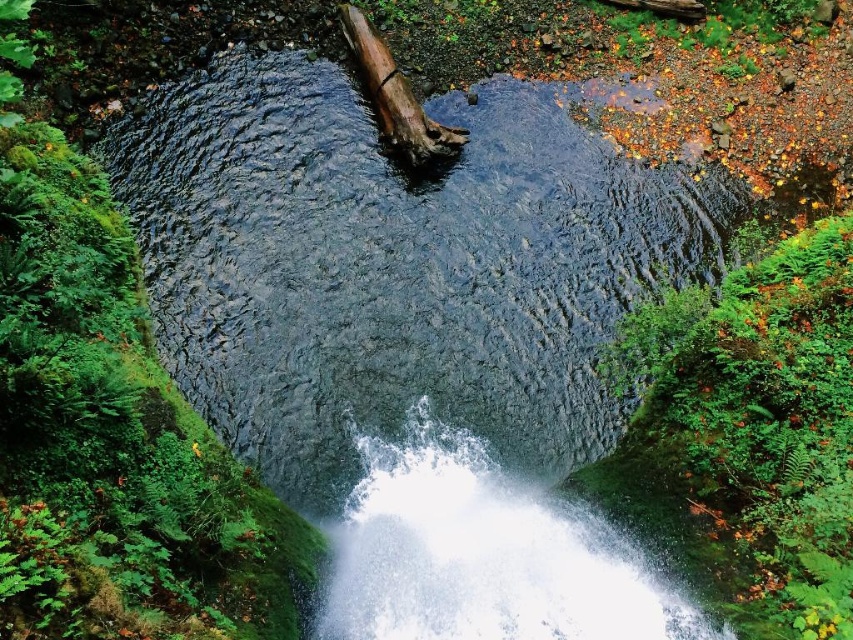
You are standing at the edge of the pool and want to cross to the other side. There is a white frothy water at center and a brown rough log at center. Which object should you step on to avoid getting wet?

The brown rough log at center is behind the white frothy water at center, so stepping on the brown rough log at center would keep you dry.

You are standing at the edge of the pool and want to avoid the white frothy water at center. Which direction should you move to stay away from it?

Since the white frothy water at center is located at point (x=485, y=556), you should move away from that coordinate to avoid it.

You are standing at the edge of the pool in the scene and want to walk towards the waterfall. Which point, point (405, 557) or point (395, 113), would you encounter first?

Point (405, 557) is in front of point (395, 113), so you would encounter point (405, 557) first as you walk towards the waterfall.